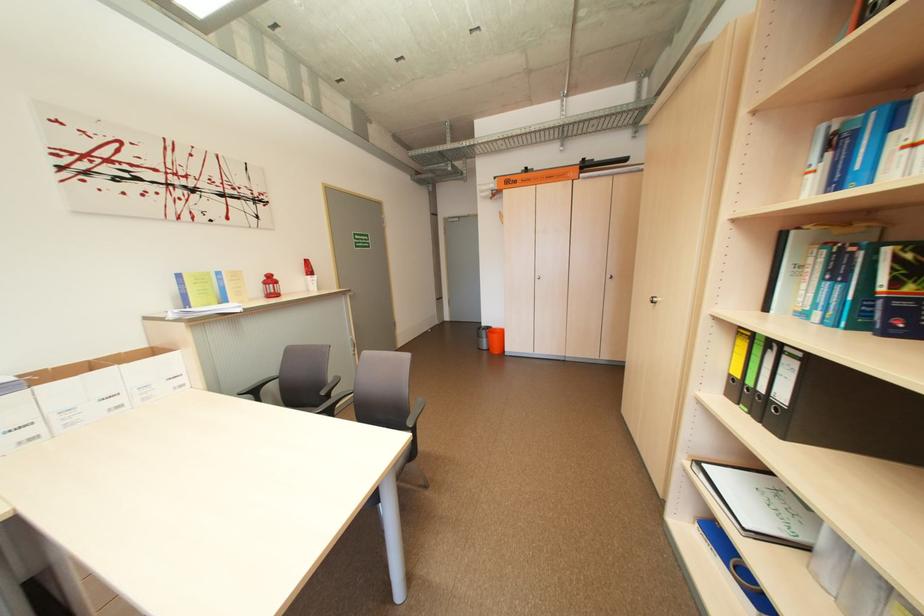
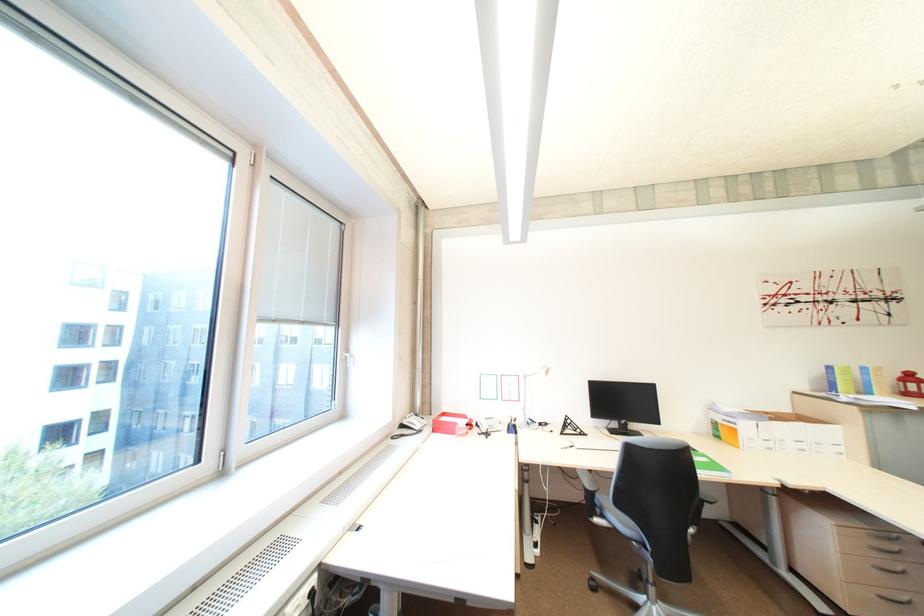
Locate, in the second image, the point that corresponds to [274,284] in the first image.

(913, 382)